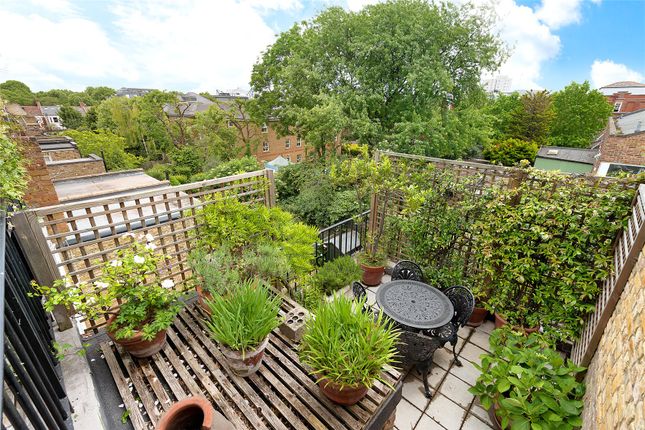
Identify the location of table. (411, 303).